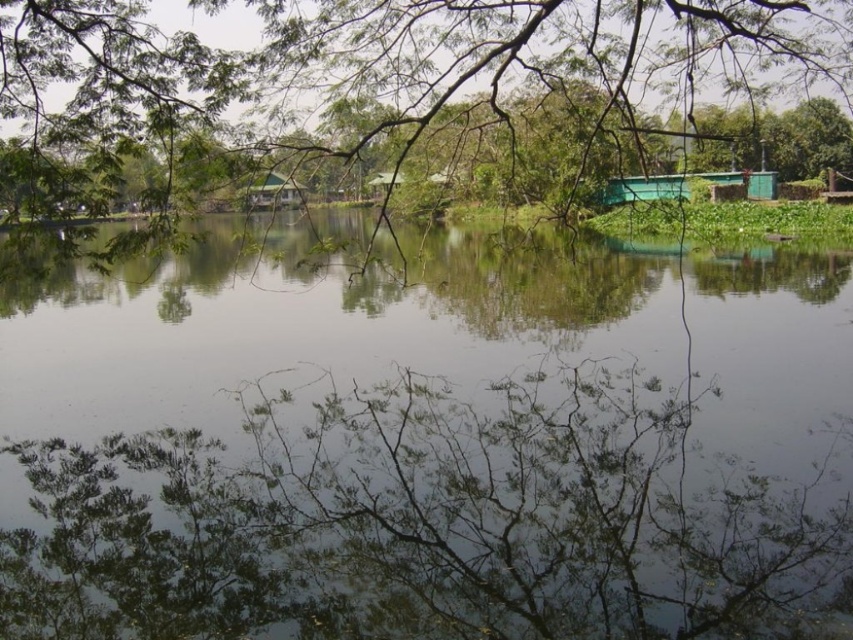
Question: Does green reflective water at center have a lesser width compared to green leafy tree at upper center?

Choices:
 (A) no
 (B) yes

Answer: (B)

Question: Does green reflective water at center lie in front of green leafy tree at upper center?

Choices:
 (A) no
 (B) yes

Answer: (A)

Question: Which point appears farthest from the camera in this image?

Choices:
 (A) (x=578, y=32)
 (B) (x=242, y=524)

Answer: (A)

Question: Can you confirm if green reflective water at center is positioned to the left of green leafy tree at upper center?

Choices:
 (A) yes
 (B) no

Answer: (A)

Question: Which of the following is the farthest from the observer?

Choices:
 (A) (695, 36)
 (B) (750, 586)

Answer: (A)